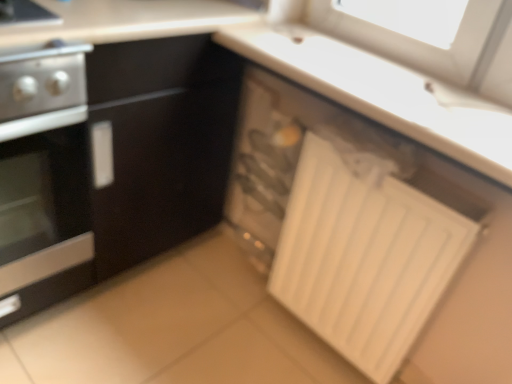
The width and height of the screenshot is (512, 384). I want to click on free space above white plastic drawer at lower right (from a real-world perspective), so click(287, 109).